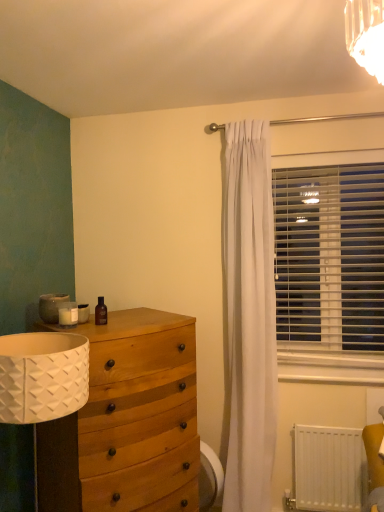
Question: Is white matte radiator at lower right positioned with its back to white plastic swivel chair at lower right?

Choices:
 (A) yes
 (B) no

Answer: (B)

Question: Is white matte radiator at lower right to the right of white plastic swivel chair at lower right from the viewer's perspective?

Choices:
 (A) no
 (B) yes

Answer: (B)

Question: Could you tell me if white matte radiator at lower right is turned towards white plastic swivel chair at lower right?

Choices:
 (A) no
 (B) yes

Answer: (A)

Question: Can you confirm if white matte radiator at lower right is thinner than white plastic swivel chair at lower right?

Choices:
 (A) no
 (B) yes

Answer: (B)

Question: Considering the relative sizes of white matte radiator at lower right and white plastic swivel chair at lower right in the image provided, is white matte radiator at lower right smaller than white plastic swivel chair at lower right?

Choices:
 (A) no
 (B) yes

Answer: (A)

Question: Considering the positions of brown glass bottle at upper left and wooden chest of drawers at left in the image, is brown glass bottle at upper left bigger or smaller than wooden chest of drawers at left?

Choices:
 (A) small
 (B) big

Answer: (A)

Question: In terms of height, does brown glass bottle at upper left look taller or shorter compared to wooden chest of drawers at left?

Choices:
 (A) tall
 (B) short

Answer: (B)

Question: Is brown glass bottle at upper left inside the boundaries of wooden chest of drawers at left, or outside?

Choices:
 (A) outside
 (B) inside

Answer: (A)

Question: Is brown glass bottle at upper left wider or thinner than wooden chest of drawers at left?

Choices:
 (A) wide
 (B) thin

Answer: (B)

Question: Considering the positions of wooden chest of drawers at left and white plastic swivel chair at lower right in the image, is wooden chest of drawers at left bigger or smaller than white plastic swivel chair at lower right?

Choices:
 (A) small
 (B) big

Answer: (B)

Question: Looking at their shapes, would you say wooden chest of drawers at left is wider or thinner than white plastic swivel chair at lower right?

Choices:
 (A) wide
 (B) thin

Answer: (A)

Question: From a real-world perspective, is wooden chest of drawers at left above or below white plastic swivel chair at lower right?

Choices:
 (A) below
 (B) above

Answer: (B)

Question: From the image's perspective, is wooden chest of drawers at left located above or below white plastic swivel chair at lower right?

Choices:
 (A) below
 (B) above

Answer: (B)

Question: From a real-world perspective, is white matte radiator at lower right positioned above or below white plastic blinds at right?

Choices:
 (A) above
 (B) below

Answer: (B)

Question: Is white matte radiator at lower right in front of or behind white plastic blinds at right in the image?

Choices:
 (A) behind
 (B) front

Answer: (B)